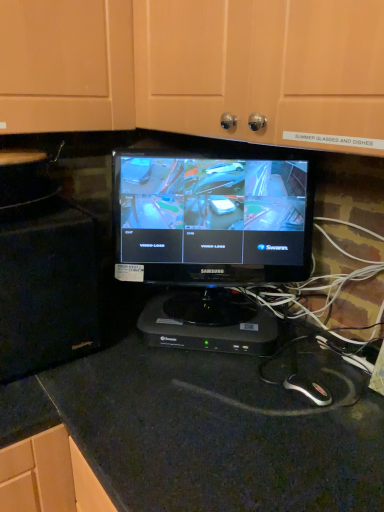
The image size is (384, 512). What do you see at coordinates (210, 242) in the screenshot?
I see `black glossy monitor at center` at bounding box center [210, 242].

The height and width of the screenshot is (512, 384). I want to click on black granite countertop at center, so click(x=210, y=429).

Consider the image. Considering the sizes of black glossy monitor at center and black granite countertop at center in the image, is black glossy monitor at center bigger or smaller than black granite countertop at center?

In the image, black glossy monitor at center appears to be smaller than black granite countertop at center.

Based on the photo, between black glossy monitor at center and black granite countertop at center, which one appears on the left side from the viewer's perspective?

Positioned to the left is black glossy monitor at center.

Is black glossy monitor at center turned away from black granite countertop at center?

That's not correct — black glossy monitor at center is not looking away from black granite countertop at center.

From the image's perspective, would you say black glossy monitor at center is shown under black granite countertop at center?

Actually, black glossy monitor at center appears above black granite countertop at center in the image.

Is black glossy monitor at center surrounded by matte black monitor at center?

Definitely not — black glossy monitor at center is not inside matte black monitor at center.

Would you say matte black monitor at center is to the left or to the right of black glossy monitor at center in the picture?

From the image, it's evident that matte black monitor at center is to the right of black glossy monitor at center.

In the scene shown: Considering the sizes of objects matte black monitor at center and black glossy monitor at center in the image provided, who is smaller, matte black monitor at center or black glossy monitor at center?

With smaller size is black glossy monitor at center.

How distant is matte black monitor at center from black glossy monitor at center?

matte black monitor at center is 11.86 inches away from black glossy monitor at center.

Between black granite countertop at center and black glossy monitor at center, which one has larger size?

Bigger between the two is black granite countertop at center.

From a real-world perspective, is black granite countertop at center positioned over black glossy monitor at center based on gravity?

Actually, black granite countertop at center is physically below black glossy monitor at center in the real world.

Is black glossy monitor at center a part of black granite countertop at center?

That's incorrect, black glossy monitor at center is not inside black granite countertop at center.

Is black granite countertop at center turned away from black glossy monitor at center?

black granite countertop at center is not turned away from black glossy monitor at center.

From a real-world perspective, which object stands above the other?

In real-world perspective, black plastic device at center is above.

Is black granite countertop at center far away from black plastic device at center?

No, black granite countertop at center is in close proximity to black plastic device at center.

Based on their positions, is black granite countertop at center located to the left or right of black plastic device at center?

From the image, it's evident that black granite countertop at center is to the right of black plastic device at center.

What's the angular difference between black granite countertop at center and black plastic device at center's facing directions?

There is a 48.1-degree angle between the facing directions of black granite countertop at center and black plastic device at center.

From the image's perspective, which one is positioned lower, black granite countertop at center or matte black monitor at center?

From the image's view, black granite countertop at center is below.

Can you confirm if black granite countertop at center is taller than matte black monitor at center?

Correct, black granite countertop at center is much taller as matte black monitor at center.

Which object is wider, black granite countertop at center or matte black monitor at center?

Wider between the two is black granite countertop at center.

In the scene shown: Which is in front, black granite countertop at center or matte black monitor at center?

matte black monitor at center.

From a real-world perspective, which is physically below, black glossy monitor at center or matte black monitor at center?

black glossy monitor at center.

Which object is positioned more to the left, black glossy monitor at center or matte black monitor at center?

Positioned to the left is black glossy monitor at center.

What's the angular difference between black glossy monitor at center and matte black monitor at center's facing directions?

52.5 degrees separate the facing orientations of black glossy monitor at center and matte black monitor at center.

From the image's perspective, is black glossy monitor at center located above matte black monitor at center?

Actually, black glossy monitor at center appears below matte black monitor at center in the image.

Find the location of a particular element. Image resolution: width=384 pixels, height=512 pixels. counter top lying below the matte black monitor at center (from the image's perspective) is located at coordinates click(x=210, y=429).

Is matte black monitor at center surrounding black granite countertop at center?

No, black granite countertop at center is located outside of matte black monitor at center.

Considering the relative sizes of matte black monitor at center and black granite countertop at center in the image provided, is matte black monitor at center bigger than black granite countertop at center?

No, matte black monitor at center is not bigger than black granite countertop at center.

From a real-world perspective, is matte black monitor at center below black granite countertop at center?

Incorrect, from a real-world perspective, matte black monitor at center is higher than black granite countertop at center.

The height and width of the screenshot is (512, 384). Identify the location of counter top located on the right of black glossy monitor at center. (210, 429).

Where is `dresser in front of the black glossy monitor at center`? dresser in front of the black glossy monitor at center is located at coordinates (197, 68).

From the image, which object appears to be nearer to black plastic device at center, black glossy monitor at center or matte black monitor at center?

black glossy monitor at center.

When comparing their distances from black granite countertop at center, does black plastic device at center or black glossy monitor at center seem closer?

Among the two, black plastic device at center is located nearer to black granite countertop at center.

When comparing their distances from black glossy monitor at center, does matte black monitor at center or black plastic device at center seem further?

matte black monitor at center.

Which object lies further to the anchor point matte black monitor at center, black granite countertop at center or black glossy monitor at center?

black granite countertop at center.

Estimate the real-world distances between objects in this image. Which object is further from matte black monitor at center, black plastic device at center or black glossy monitor at center?

black plastic device at center is further to matte black monitor at center.

When comparing their distances from black plastic device at center, does black granite countertop at center or black glossy monitor at center seem closer?

black glossy monitor at center.

When comparing their distances from black plastic device at center, does black granite countertop at center or matte black monitor at center seem further?

matte black monitor at center is positioned further to the anchor black plastic device at center.

Considering their positions, is black glossy monitor at center positioned further to black granite countertop at center than matte black monitor at center?

Based on the image, matte black monitor at center appears to be further to black granite countertop at center.

In order to click on appliance between matte black monitor at center and black granite countertop at center in the up-down direction in this screenshot , I will do `click(208, 323)`.

Identify the location of computer monitor between matte black monitor at center and black granite countertop at center in the vertical direction. The height and width of the screenshot is (512, 384). (210, 242).

The height and width of the screenshot is (512, 384). In order to click on computer monitor between matte black monitor at center and black plastic device at center from front to back in this screenshot , I will do `click(210, 242)`.

Identify the location of appliance that lies between black glossy monitor at center and black granite countertop at center from top to bottom. This screenshot has width=384, height=512. (208, 323).